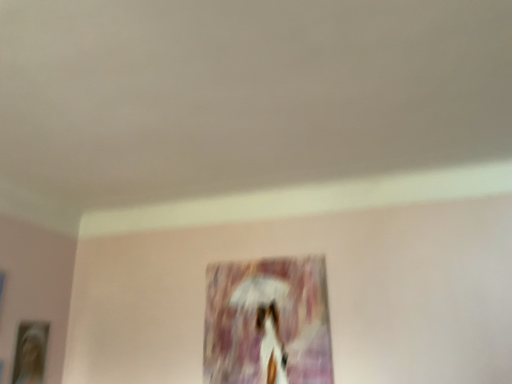
Question: In the image, is matte purple painting at center, the first picture frame when ordered from right to left, on the left side or the right side of wooden photo frame at lower left, the 2th picture frame when ordered from right to left?

Choices:
 (A) left
 (B) right

Answer: (B)

Question: From the image's perspective, is matte purple painting at center, arranged as the 2th picture frame when viewed from the left, located above or below wooden photo frame at lower left, the 2th picture frame when ordered from right to left?

Choices:
 (A) below
 (B) above

Answer: (B)

Question: In terms of width, does matte purple painting at center, arranged as the 2th picture frame when viewed from the left, look wider or thinner when compared to wooden photo frame at lower left, the 2th picture frame when ordered from right to left?

Choices:
 (A) wide
 (B) thin

Answer: (B)

Question: Is point (36, 362) closer or farther from the camera than point (318, 345)?

Choices:
 (A) closer
 (B) farther

Answer: (B)

Question: Considering the positions of wooden photo frame at lower left, the 2th picture frame when ordered from right to left, and matte purple painting at center, the first picture frame when ordered from right to left, in the image, is wooden photo frame at lower left, the 2th picture frame when ordered from right to left, taller or shorter than matte purple painting at center, the first picture frame when ordered from right to left,?

Choices:
 (A) short
 (B) tall

Answer: (A)

Question: Is wooden photo frame at lower left, the 2th picture frame when ordered from right to left, to the left or to the right of matte purple painting at center, the first picture frame when ordered from right to left, in the image?

Choices:
 (A) right
 (B) left

Answer: (B)

Question: From a real-world perspective, is wooden photo frame at lower left, the 1th picture frame viewed from the left, physically located above or below matte purple painting at center, the first picture frame when ordered from right to left?

Choices:
 (A) below
 (B) above

Answer: (A)